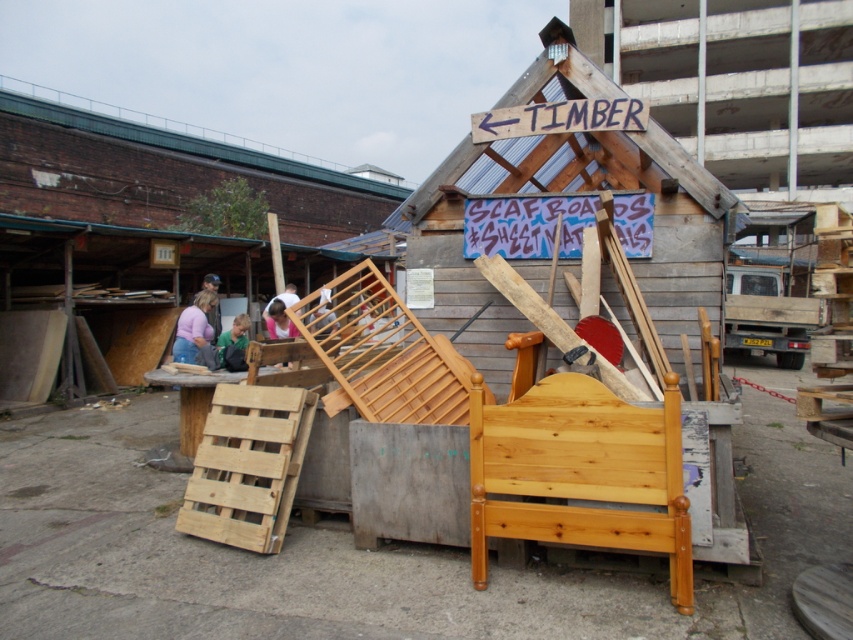
You are organizing a clothing donation drive and have two items in front of you on a table. The light purple fabric at center and the pink fabric shirt at center. Which item is narrower?

The light purple fabric at center is narrower than the pink fabric shirt at center.

You are standing in front of the wooden structure with the sign. There are two points marked in the scene. Which point, point [280,317] or point [210,278], is closer to you?

Point [280,317] is closer to the viewer than point [210,278].